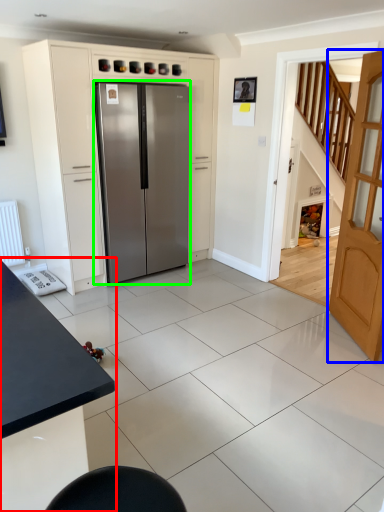
Question: Considering the real-world distances, which object is closest to table (highlighted by a red box)? door (highlighted by a blue box) or refrigerator (highlighted by a green box).

Choices:
 (A) door
 (B) refrigerator

Answer: (A)